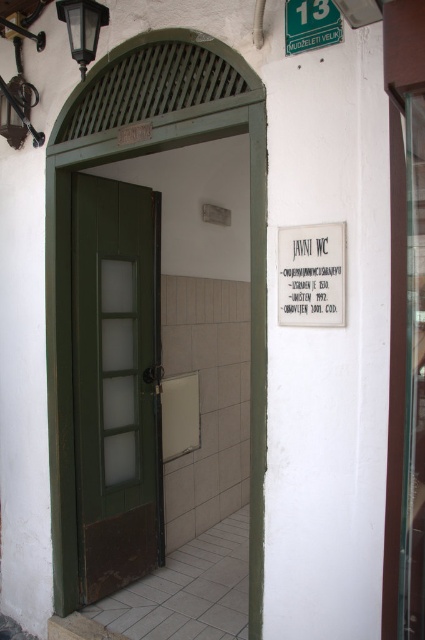
You are standing in front of the public restroom door and need to read the white paper sign at center. Is the sign positioned above or below the door frame?

The white paper sign at center is located at point coordinates indicating it is below the door frame.